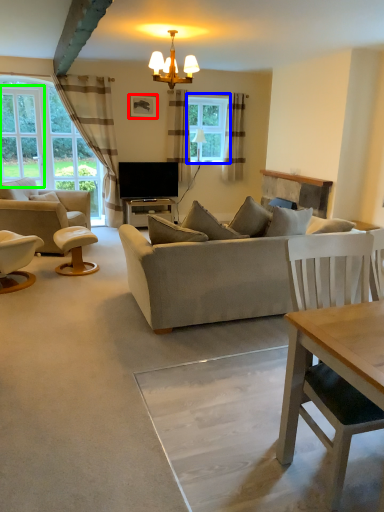
Question: Which object is the closest to the picture frame (highlighted by a red box)? Choose among these: window (highlighted by a blue box) or window screen (highlighted by a green box).

Choices:
 (A) window
 (B) window screen

Answer: (A)